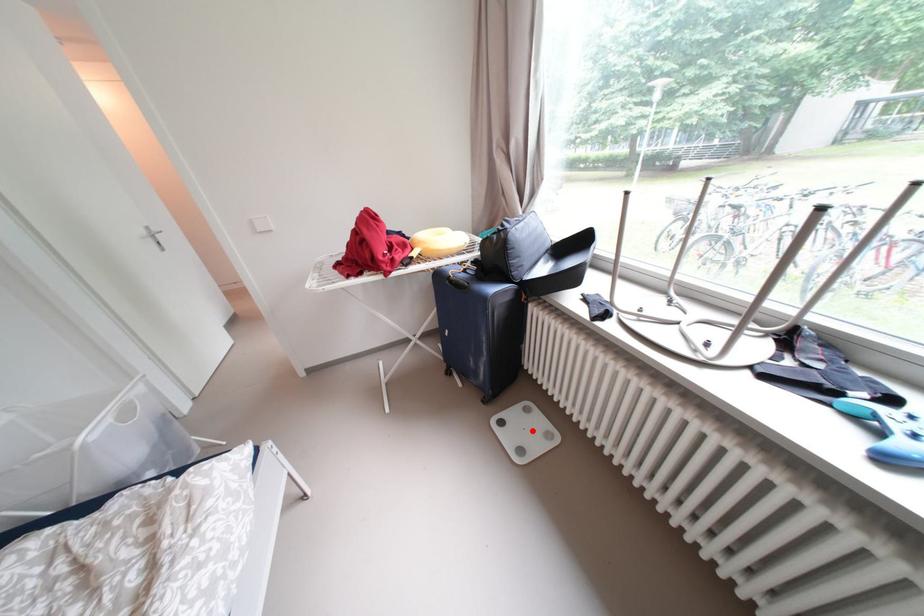
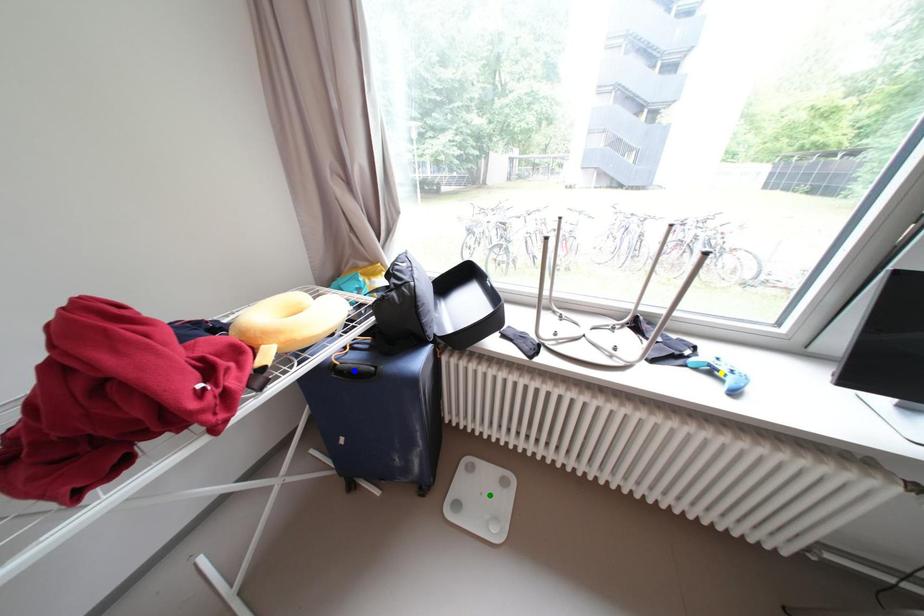
Question: I am providing you with two images of the same scene from different viewpoints. A red point is marked on the first image. You are given multiple points on the second image. Which point in image 2 is actually the same real-world point as the red point in image 1?

Choices:
 (A) yellow point
 (B) green point
 (C) blue point

Answer: (B)